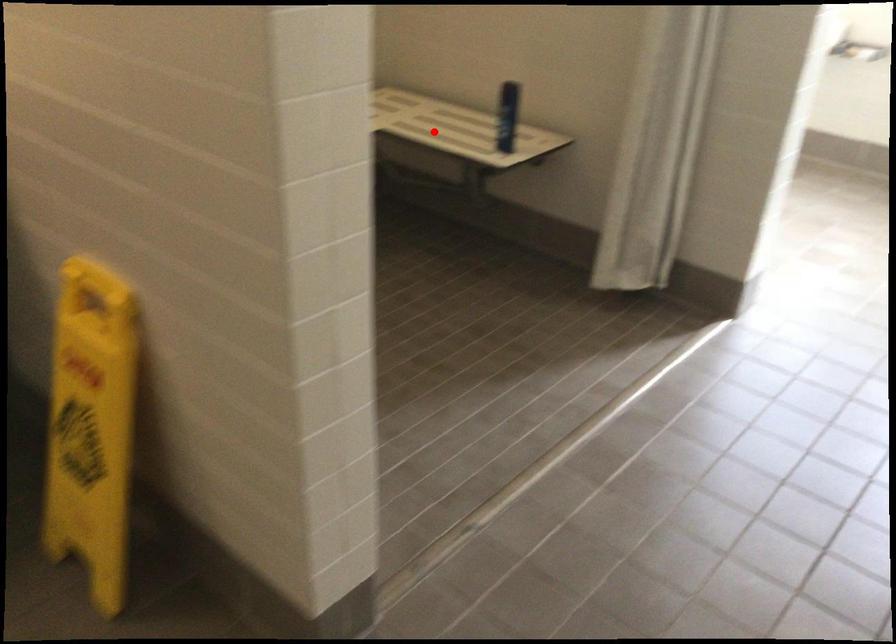
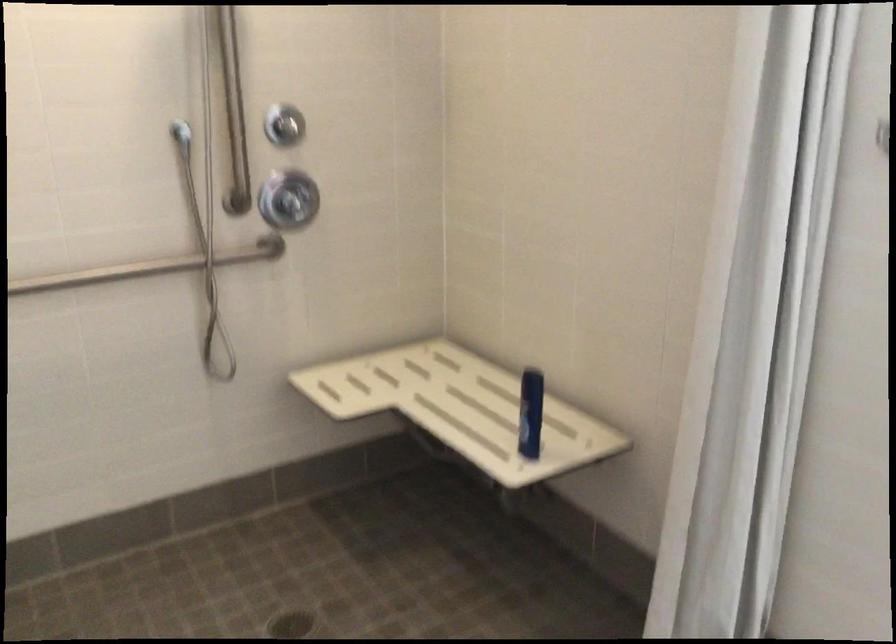
Question: I am providing you with two images of the same scene from different viewpoints. A red point is shown in image1. For the corresponding object point in image2, is it positioned nearer or farther from the camera?

Choices:
 (A) Nearer
 (B) Farther

Answer: (A)